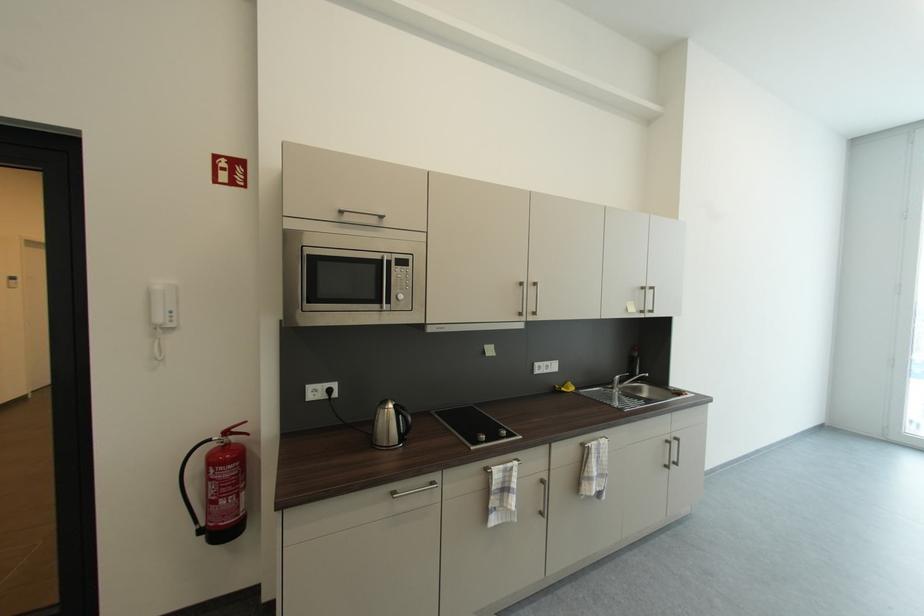
Where is `faucet handle`? This screenshot has height=616, width=924. faucet handle is located at coordinates (630, 379).